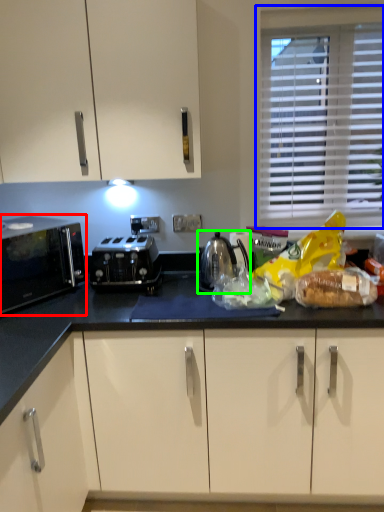
Question: Which is nearer to the home appliance (highlighted by a red box)? window (highlighted by a blue box) or kitchen appliance (highlighted by a green box).

Choices:
 (A) window
 (B) kitchen appliance

Answer: (B)